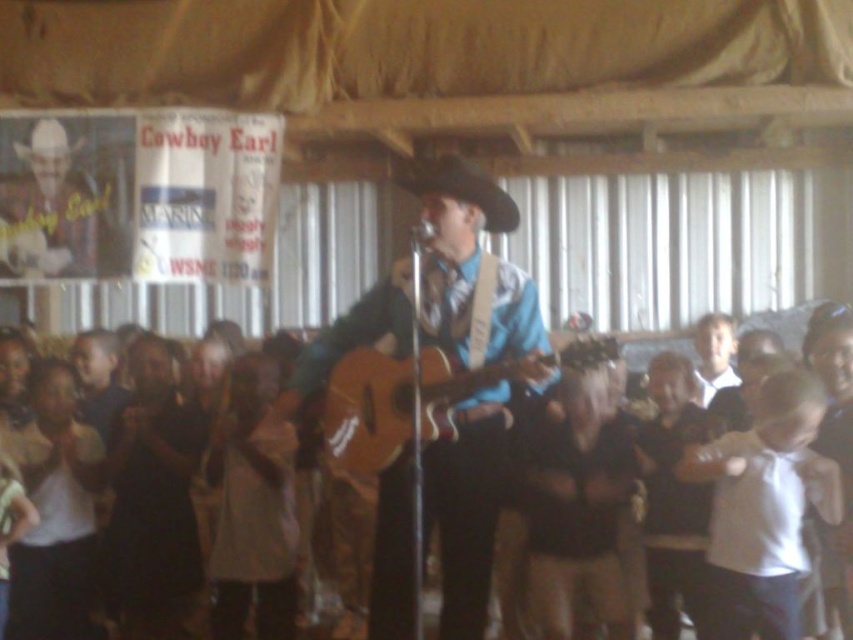
Question: Which point is closer to the camera taking this photo?

Choices:
 (A) (38, 410)
 (B) (235, 436)

Answer: (A)

Question: Considering the real-world distances, which object is farthest from the wooden guitar at center?

Choices:
 (A) light brown fabric at lower center
 (B) acoustic wood guitar at center
 (C) white matte shirt at lower right
 (D) white felt cowboy hat at upper left

Answer: (C)

Question: Can you confirm if light brown fabric shirt at lower left is smaller than light brown fabric at lower center?

Choices:
 (A) yes
 (B) no

Answer: (B)

Question: Can you confirm if wooden acoustic guitar at center is bigger than light brown fabric shirt at lower left?

Choices:
 (A) yes
 (B) no

Answer: (A)

Question: Can you confirm if white felt cowboy hat at upper left is positioned below wooden guitar at center?

Choices:
 (A) no
 (B) yes

Answer: (A)

Question: Estimate the real-world distances between objects in this image. Which object is closer to the white matte shirt at lower right?

Choices:
 (A) wooden acoustic guitar at center
 (B) light brown fabric shirt at lower left
 (C) acoustic wood guitar at center

Answer: (A)